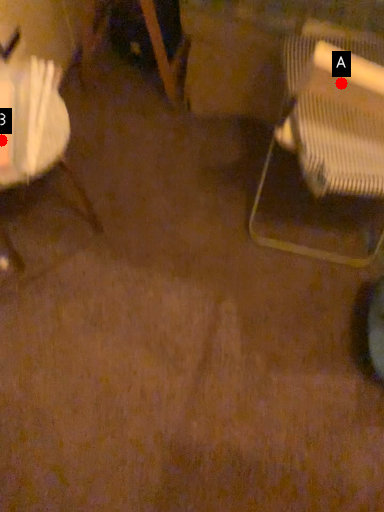
Question: Two points are circled on the image, labeled by A and B beside each circle. Which point is farther from the camera taking this photo?

Choices:
 (A) A is further
 (B) B is further

Answer: (A)